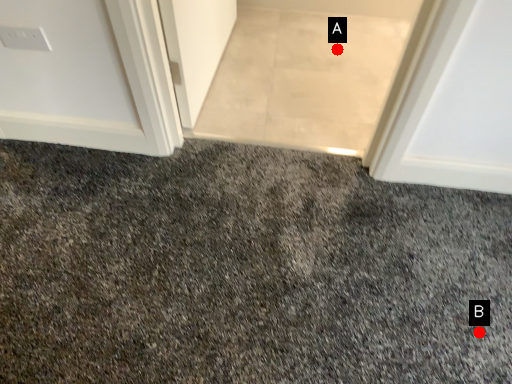
Question: Two points are circled on the image, labeled by A and B beside each circle. Which point appears farthest from the camera in this image?

Choices:
 (A) A is further
 (B) B is further

Answer: (A)